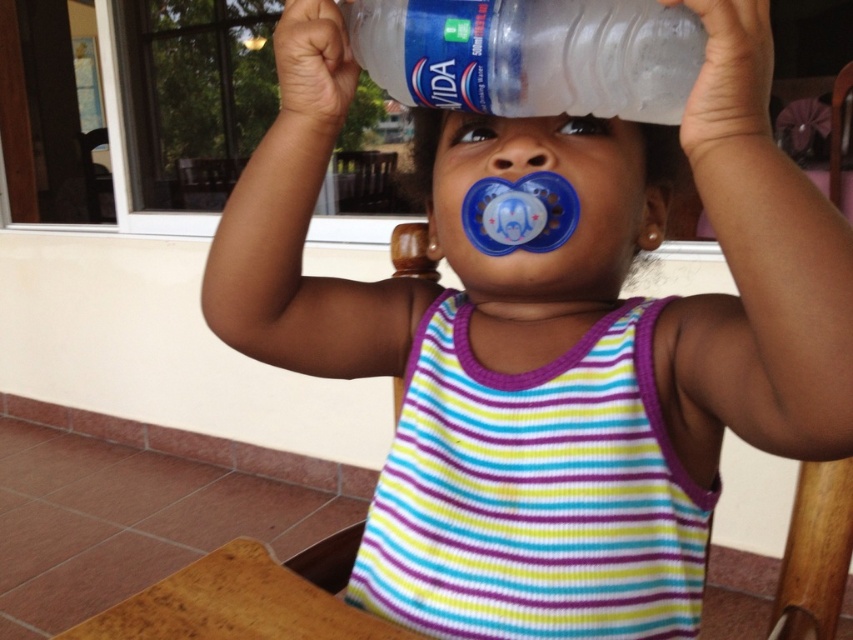
You are a photographer trying to capture a closeup of the transparent plastic bottle at center. The camera you are using has a minimum focusing distance of 50 centimeters. Can you take the photo without moving the bottle or the camera?

The transparent plastic bottle at center and camera are 50.76 centimeters apart. Since the minimum focusing distance is 50 centimeters, the photographer can take the photo without moving the bottle or the camera because the distance is within the camera range.

The child is holding a transparent plastic bottle at center and has a matte blue pacifier at center in their mouth. Which object is positioned higher relative to the other?

The transparent plastic bottle at center is located above the matte blue pacifier at center.

You are a photographer trying to capture the child holding the bottle. You notice two points marked in the image at coordinates point (x=521, y=106) and point (x=538, y=125). Which point should you focus on to ensure the child is in focus if you want to prioritize the foreground?

Point (x=521, y=106) is in front of point (x=538, y=125), so focusing on point (x=521, y=106) will ensure the child in the foreground is in focus.